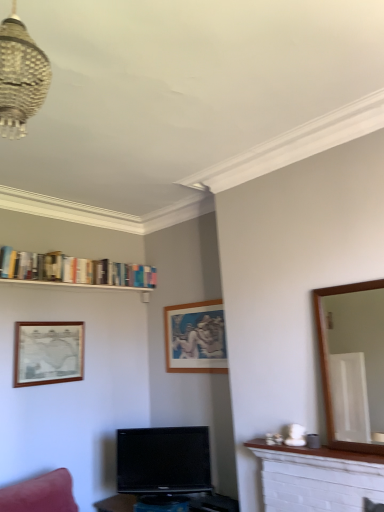
Find the location of a particular element. free space above brown wooden mirror at right (from a real-world perspective) is located at coordinates (350, 277).